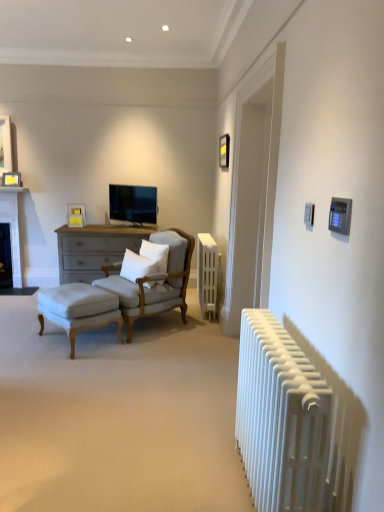
Question: Considering the relative sizes of white soft pillow at center, acting as the second pillow starting from the left, and dark gray stone fireplace at left, acting as the 2th fireplace starting from the top, in the image provided, is white soft pillow at center, acting as the second pillow starting from the left, wider than dark gray stone fireplace at left, acting as the 2th fireplace starting from the top,?

Choices:
 (A) no
 (B) yes

Answer: (A)

Question: Could dark gray stone fireplace at left, acting as the 2th fireplace starting from the top, be considered to be inside white soft pillow at center, acting as the second pillow starting from the left?

Choices:
 (A) yes
 (B) no

Answer: (B)

Question: Can you confirm if white soft pillow at center, the first pillow in the right-to-left sequence, is shorter than dark gray stone fireplace at left, acting as the 2th fireplace starting from the top?

Choices:
 (A) no
 (B) yes

Answer: (B)

Question: From the image's perspective, would you say white soft pillow at center, acting as the second pillow starting from the left, is positioned over dark gray stone fireplace at left, placed as the 1th fireplace when sorted from bottom to top?

Choices:
 (A) yes
 (B) no

Answer: (B)

Question: Is white soft pillow at center, acting as the second pillow starting from the left, oriented away from dark gray stone fireplace at left, placed as the 1th fireplace when sorted from bottom to top?

Choices:
 (A) no
 (B) yes

Answer: (A)

Question: From a real-world perspective, is matte black picture frame at upper center, which ranks as the 1th picture frame in right-to-left order, above or below white metallic radiator at right, which is counted as the 2th radiator, starting from the back?

Choices:
 (A) below
 (B) above

Answer: (B)

Question: Would you say matte black picture frame at upper center, the third picture frame when ordered from bottom to top, is inside or outside white metallic radiator at right, which is counted as the 2th radiator, starting from the back?

Choices:
 (A) inside
 (B) outside

Answer: (B)

Question: Is matte black picture frame at upper center, arranged as the 3th picture frame when viewed from the left, bigger or smaller than white metallic radiator at right, the 1th radiator from the front?

Choices:
 (A) small
 (B) big

Answer: (A)

Question: Considering the positions of point (223, 148) and point (279, 468), is point (223, 148) closer or farther from the camera than point (279, 468)?

Choices:
 (A) farther
 (B) closer

Answer: (A)

Question: Choose the correct answer: Is white stone fireplace at left, the first fireplace from the top, inside matte yellow picture frame at upper left, acting as the first picture frame starting from the bottom, or outside it?

Choices:
 (A) outside
 (B) inside

Answer: (A)

Question: Would you say white stone fireplace at left, the first fireplace from the top, is to the left or to the right of matte yellow picture frame at upper left, which appears as the second picture frame when viewed from the right, in the picture?

Choices:
 (A) left
 (B) right

Answer: (A)

Question: Looking at the image, does white stone fireplace at left, the first fireplace from the top, seem bigger or smaller compared to matte yellow picture frame at upper left, which is counted as the third picture frame, starting from the top?

Choices:
 (A) big
 (B) small

Answer: (A)

Question: In terms of height, does white stone fireplace at left, the first fireplace from the top, look taller or shorter compared to matte yellow picture frame at upper left, the 3th picture frame when ordered from front to back?

Choices:
 (A) tall
 (B) short

Answer: (A)

Question: Is white stone fireplace at left, arranged as the 2th fireplace when ordered from the bottom, taller or shorter than white soft pillow at center, the first pillow in the right-to-left sequence?

Choices:
 (A) short
 (B) tall

Answer: (B)

Question: From the image's perspective, relative to white soft pillow at center, the first pillow in the right-to-left sequence, is white stone fireplace at left, arranged as the 2th fireplace when ordered from the bottom, above or below?

Choices:
 (A) below
 (B) above

Answer: (B)